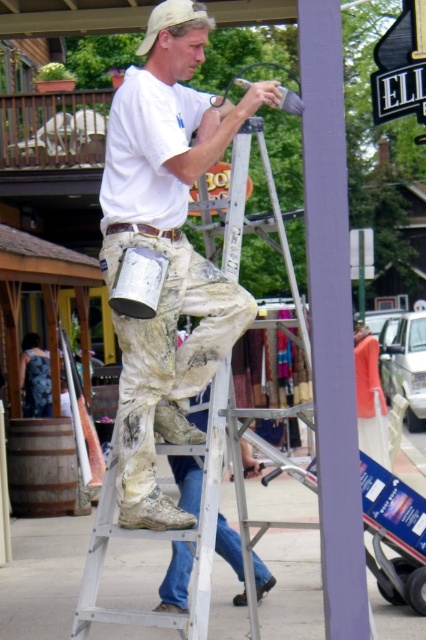
How far apart are silver metallic ladder at center and wooden barrel at lower left?

silver metallic ladder at center is 7.15 meters from wooden barrel at lower left.

The image size is (426, 640). What are the coordinates of `silver metallic ladder at center` in the screenshot? It's located at (160, 538).

Find the location of a particular element. The width and height of the screenshot is (426, 640). silver metallic ladder at center is located at coordinates (160, 538).